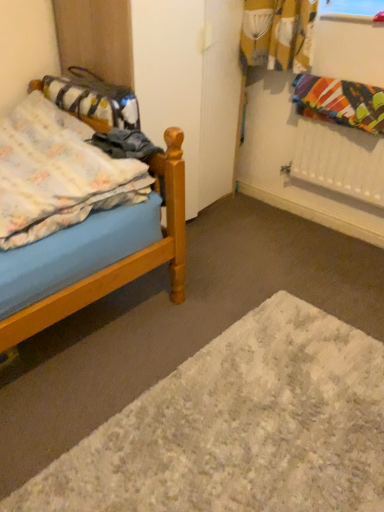
Question: Considering the relative positions of multicolored fabric at upper right, positioned as the second blanket in left-to-right order, and white shaggy rug at lower center in the image provided, is multicolored fabric at upper right, positioned as the second blanket in left-to-right order, to the right of white shaggy rug at lower center from the viewer's perspective?

Choices:
 (A) yes
 (B) no

Answer: (A)

Question: Does multicolored fabric at upper right, positioned as the second blanket in left-to-right order, have a greater height compared to white shaggy rug at lower center?

Choices:
 (A) no
 (B) yes

Answer: (B)

Question: Is multicolored fabric at upper right, positioned as the second blanket in left-to-right order, positioned before white shaggy rug at lower center?

Choices:
 (A) yes
 (B) no

Answer: (B)

Question: Can you confirm if multicolored fabric at upper right, marked as the 1th blanket in a right-to-left arrangement, is positioned to the left of white shaggy rug at lower center?

Choices:
 (A) yes
 (B) no

Answer: (B)

Question: From a real-world perspective, is multicolored fabric at upper right, positioned as the second blanket in left-to-right order, below white shaggy rug at lower center?

Choices:
 (A) no
 (B) yes

Answer: (A)

Question: Considering the relative sizes of multicolored fabric at upper right, positioned as the second blanket in left-to-right order, and white shaggy rug at lower center in the image provided, is multicolored fabric at upper right, positioned as the second blanket in left-to-right order, thinner than white shaggy rug at lower center?

Choices:
 (A) yes
 (B) no

Answer: (A)

Question: Does wooden bed at left have a greater width compared to fluffy cotton blanket at left, the first blanket when ordered from left to right?

Choices:
 (A) no
 (B) yes

Answer: (B)

Question: Does wooden bed at left have a larger size compared to fluffy cotton blanket at left, acting as the second blanket starting from the right?

Choices:
 (A) yes
 (B) no

Answer: (A)

Question: From a real-world perspective, is wooden bed at left positioned over fluffy cotton blanket at left, acting as the second blanket starting from the right, based on gravity?

Choices:
 (A) yes
 (B) no

Answer: (B)

Question: Is the surface of wooden bed at left in direct contact with fluffy cotton blanket at left, acting as the second blanket starting from the right?

Choices:
 (A) no
 (B) yes

Answer: (A)

Question: From the image's perspective, would you say wooden bed at left is positioned over fluffy cotton blanket at left, acting as the second blanket starting from the right?

Choices:
 (A) no
 (B) yes

Answer: (A)

Question: Considering the relative sizes of wooden bed at left and fluffy cotton blanket at left, acting as the second blanket starting from the right, in the image provided, is wooden bed at left smaller than fluffy cotton blanket at left, acting as the second blanket starting from the right,?

Choices:
 (A) yes
 (B) no

Answer: (B)

Question: Does fluffy fabric bag at left have a smaller size compared to wooden bed at left?

Choices:
 (A) yes
 (B) no

Answer: (A)